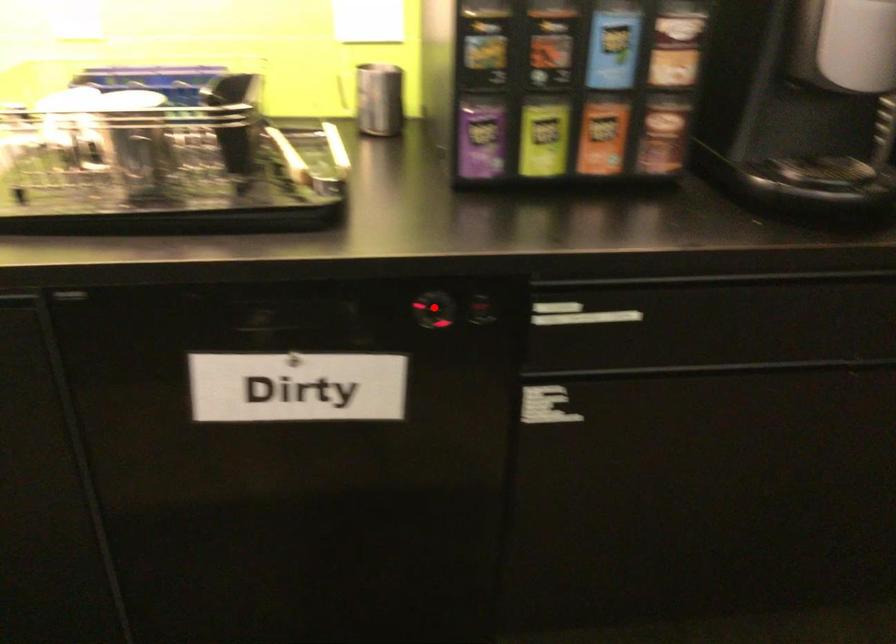
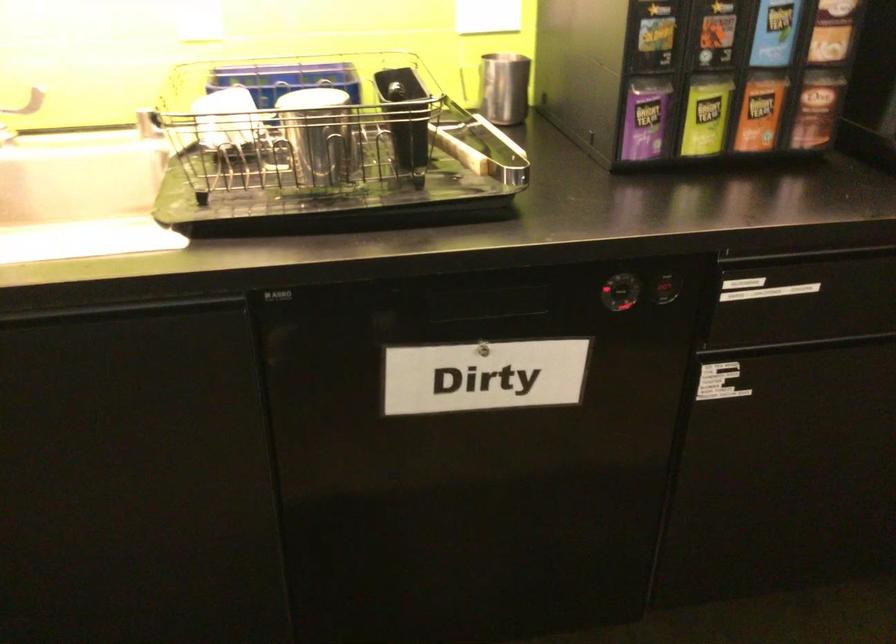
In the second image, find the point that corresponds to the highlighted location in the first image.

(623, 290)